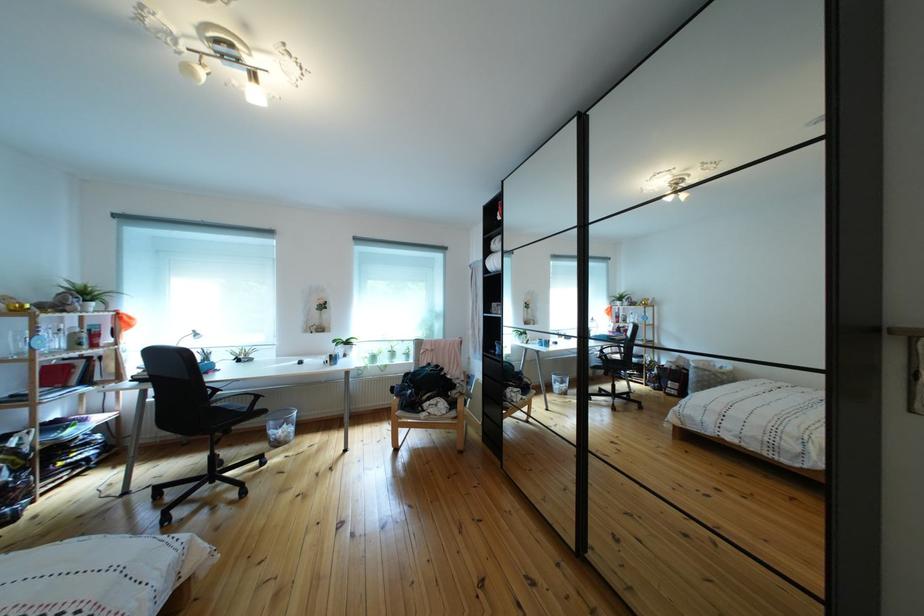
The image size is (924, 616). Describe the element at coordinates (225, 411) in the screenshot. I see `a chair sitting surface` at that location.